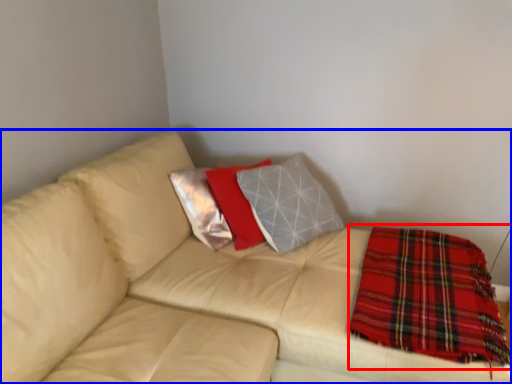
Question: Which point is closer to the camera, blanket (highlighted by a red box) or studio couch (highlighted by a blue box)?

Choices:
 (A) blanket
 (B) studio couch

Answer: (B)